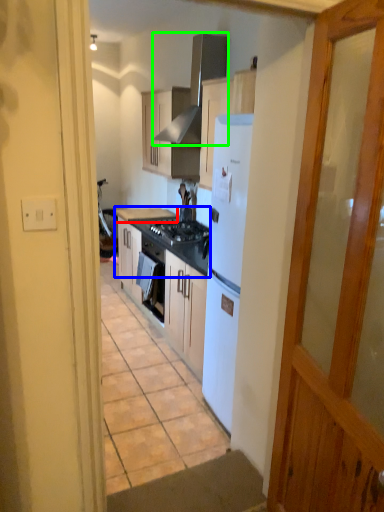
Question: Estimate the real-world distances between objects in this image. Which object is farther from countertop (highlighted by a red box), countertop (highlighted by a blue box) or exhaust hood (highlighted by a green box)?

Choices:
 (A) countertop
 (B) exhaust hood

Answer: (B)